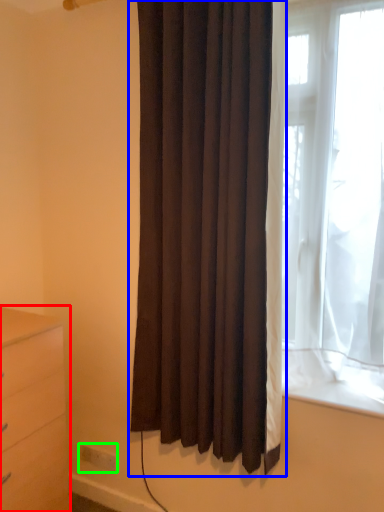
Question: Which is nearer to the chest of drawers (highlighted by a red box)? curtain (highlighted by a blue box) or electric outlet (highlighted by a green box).

Choices:
 (A) curtain
 (B) electric outlet

Answer: (A)